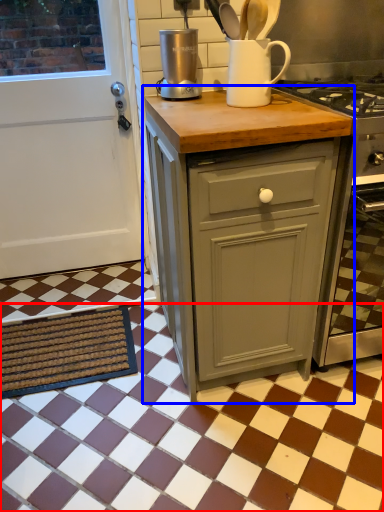
Question: Which point is closer to the camera, tile (highlighted by a red box) or cabinetry (highlighted by a blue box)?

Choices:
 (A) tile
 (B) cabinetry

Answer: (A)